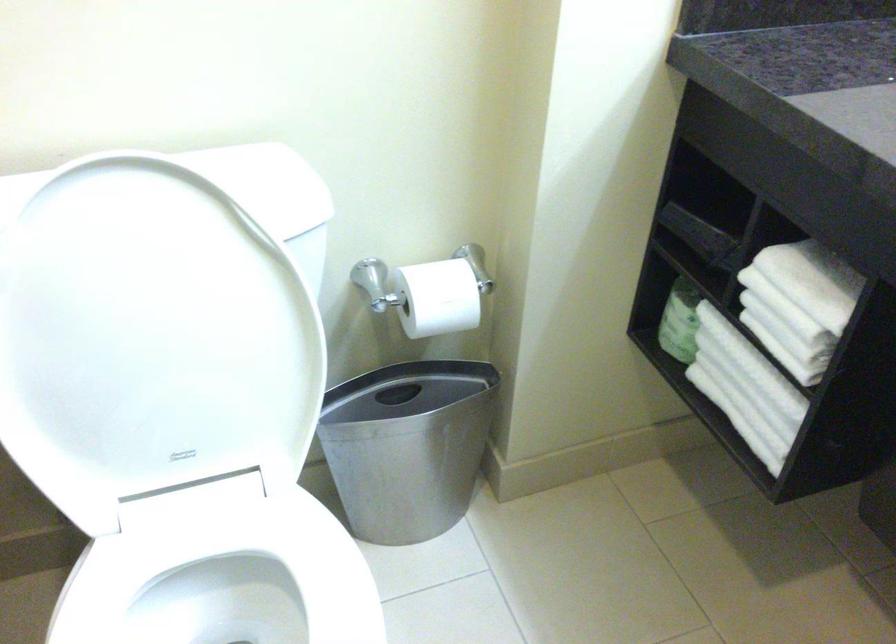
Locate an element on the screen. The image size is (896, 644). toilet paper roll is located at coordinates (436, 298).